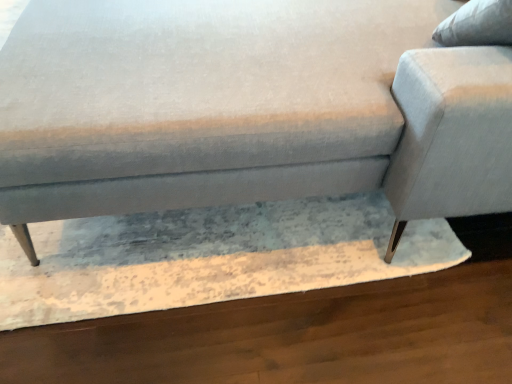
This screenshot has width=512, height=384. What do you see at coordinates (247, 109) in the screenshot?
I see `textured fabric couch at center` at bounding box center [247, 109].

The width and height of the screenshot is (512, 384). Identify the location of textured fabric couch at center. (247, 109).

What is the approximate width of textured fabric couch at center?

textured fabric couch at center is 1.83 meters wide.

From the picture: Measure the distance between point (398, 112) and camera.

The distance of point (398, 112) from camera is 35.08 inches.

What do you see at coordinates (455, 121) in the screenshot? I see `light gray fabric swivel chair at upper right` at bounding box center [455, 121].

In order to face light gray fabric swivel chair at upper right, should I rotate leftwards or rightwards?

Turn right by 31.386 degrees to look at light gray fabric swivel chair at upper right.

Locate an element on the screen. The width and height of the screenshot is (512, 384). light gray fabric swivel chair at upper right is located at coordinates (455, 121).

The width and height of the screenshot is (512, 384). I want to click on textured fabric couch at center, so click(x=247, y=109).

Is light gray fabric swivel chair at upper right to the right of textured fabric couch at center from the viewer's perspective?

Indeed, light gray fabric swivel chair at upper right is positioned on the right side of textured fabric couch at center.

Is the position of light gray fabric swivel chair at upper right more distant than that of textured fabric couch at center?

That is True.

Which is closer to the camera, (409, 115) or (119, 74)?

The point (409, 115) is more forward.

From the image's perspective, would you say light gray fabric swivel chair at upper right is shown under textured fabric couch at center?

Indeed, from the image's perspective, light gray fabric swivel chair at upper right is shown beneath textured fabric couch at center.

From a real-world perspective, is light gray fabric swivel chair at upper right below textured fabric couch at center?

No, from a real-world perspective, light gray fabric swivel chair at upper right is not below textured fabric couch at center.

Which of these two, light gray fabric swivel chair at upper right or textured fabric couch at center, is thinner?

light gray fabric swivel chair at upper right is thinner.

Considering the relative sizes of light gray fabric swivel chair at upper right and textured fabric couch at center in the image provided, is light gray fabric swivel chair at upper right shorter than textured fabric couch at center?

Yes.

Considering the relative sizes of light gray fabric swivel chair at upper right and textured fabric couch at center in the image provided, is light gray fabric swivel chair at upper right smaller than textured fabric couch at center?

Correct, light gray fabric swivel chair at upper right occupies less space than textured fabric couch at center.

Does light gray fabric swivel chair at upper right contain textured fabric couch at center?

No, textured fabric couch at center is not surrounded by light gray fabric swivel chair at upper right.

Are light gray fabric swivel chair at upper right and textured fabric couch at center far apart?

No, there isn't a large distance between light gray fabric swivel chair at upper right and textured fabric couch at center.

Is light gray fabric swivel chair at upper right oriented towards textured fabric couch at center?

Yes, light gray fabric swivel chair at upper right is facing textured fabric couch at center.

How many degrees apart are the facing directions of light gray fabric swivel chair at upper right and textured fabric couch at center?

There is a 92.2-degree angle between the facing directions of light gray fabric swivel chair at upper right and textured fabric couch at center.

Where is `swivel chair that is behind the textured fabric couch at center`? swivel chair that is behind the textured fabric couch at center is located at coordinates (455, 121).

Consider the image. Can you confirm if textured fabric couch at center is positioned to the left of light gray fabric swivel chair at upper right?

Correct, you'll find textured fabric couch at center to the left of light gray fabric swivel chair at upper right.

Is textured fabric couch at center in front of or behind light gray fabric swivel chair at upper right in the image?

textured fabric couch at center is positioned closer to the viewer than light gray fabric swivel chair at upper right.

Between point (197, 94) and point (452, 40), which one is positioned in front?

The point (197, 94) is closer.

From the image's perspective, is textured fabric couch at center above or below light gray fabric swivel chair at upper right?

From the image's perspective, textured fabric couch at center appears above light gray fabric swivel chair at upper right.

From a real-world perspective, who is located higher, textured fabric couch at center or light gray fabric swivel chair at upper right?

light gray fabric swivel chair at upper right, from a real-world perspective.

Considering the relative sizes of textured fabric couch at center and light gray fabric swivel chair at upper right in the image provided, is textured fabric couch at center wider than light gray fabric swivel chair at upper right?

Indeed, textured fabric couch at center has a greater width compared to light gray fabric swivel chair at upper right.

Between textured fabric couch at center and light gray fabric swivel chair at upper right, which one has more height?

textured fabric couch at center.

Consider the image. Considering the sizes of textured fabric couch at center and light gray fabric swivel chair at upper right in the image, is textured fabric couch at center bigger or smaller than light gray fabric swivel chair at upper right?

Clearly, textured fabric couch at center is larger in size than light gray fabric swivel chair at upper right.

Is textured fabric couch at center inside the boundaries of light gray fabric swivel chair at upper right, or outside?

The correct answer is: outside.

Based on the photo, is there a large distance between textured fabric couch at center and light gray fabric swivel chair at upper right?

textured fabric couch at center is actually quite close to light gray fabric swivel chair at upper right.

Is textured fabric couch at center facing towards light gray fabric swivel chair at upper right?

No, textured fabric couch at center is not facing towards light gray fabric swivel chair at upper right.

How many degrees apart are the facing directions of textured fabric couch at center and light gray fabric swivel chair at upper right?

The angle between the facing direction of textured fabric couch at center and the facing direction of light gray fabric swivel chair at upper right is 92.2 degrees.

Where is `swivel chair that appears on the right of textured fabric couch at center`? This screenshot has height=384, width=512. swivel chair that appears on the right of textured fabric couch at center is located at coordinates point(455,121).

You are a GUI agent. You are given a task and a screenshot of the screen. Output one action in this format:
    pyautogui.click(x=<x>, y=<y>)
    Task: Click on the swivel chair above the textured fabric couch at center (from a real-world perspective)
    
    Given the screenshot: What is the action you would take?
    pyautogui.click(x=455, y=121)

Where is `swivel chair below the textured fabric couch at center (from the image's perspective)`? The height and width of the screenshot is (384, 512). swivel chair below the textured fabric couch at center (from the image's perspective) is located at coordinates (455, 121).